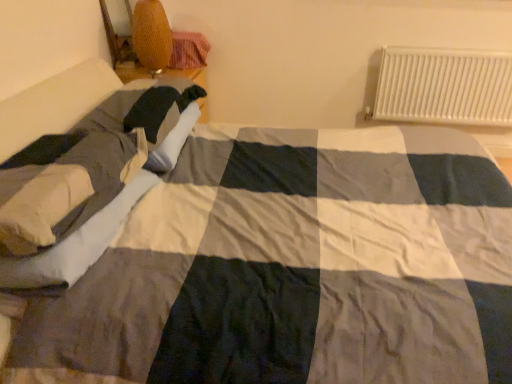
Question: From the image's perspective, does soft beige pillow at left appear higher than woven wicker lampshade at upper left?

Choices:
 (A) yes
 (B) no

Answer: (B)

Question: Is soft beige pillow at left oriented away from woven wicker lampshade at upper left?

Choices:
 (A) yes
 (B) no

Answer: (B)

Question: Does soft beige pillow at left have a smaller size compared to woven wicker lampshade at upper left?

Choices:
 (A) yes
 (B) no

Answer: (B)

Question: Considering the relative sizes of soft beige pillow at left and woven wicker lampshade at upper left in the image provided, is soft beige pillow at left thinner than woven wicker lampshade at upper left?

Choices:
 (A) no
 (B) yes

Answer: (A)

Question: Can you confirm if soft beige pillow at left is positioned to the left of woven wicker lampshade at upper left?

Choices:
 (A) no
 (B) yes

Answer: (B)

Question: Considering their positions, is soft beige pillow at left located in front of or behind woven wicker lampshade at upper left?

Choices:
 (A) behind
 (B) front

Answer: (B)

Question: From a real-world perspective, is soft beige pillow at left above or below woven wicker lampshade at upper left?

Choices:
 (A) above
 (B) below

Answer: (B)

Question: In terms of height, does soft beige pillow at left look taller or shorter compared to woven wicker lampshade at upper left?

Choices:
 (A) short
 (B) tall

Answer: (A)

Question: Is soft beige pillow at left wider or thinner than woven wicker lampshade at upper left?

Choices:
 (A) wide
 (B) thin

Answer: (A)

Question: Considering the positions of soft beige pillow at left and white metal radiator at upper right in the image, is soft beige pillow at left bigger or smaller than white metal radiator at upper right?

Choices:
 (A) big
 (B) small

Answer: (A)

Question: Is soft beige pillow at left wider or thinner than white metal radiator at upper right?

Choices:
 (A) wide
 (B) thin

Answer: (A)

Question: From the image's perspective, is soft beige pillow at left positioned above or below white metal radiator at upper right?

Choices:
 (A) below
 (B) above

Answer: (A)

Question: Is soft beige pillow at left in front of or behind white metal radiator at upper right in the image?

Choices:
 (A) behind
 (B) front

Answer: (B)

Question: From a real-world perspective, is woven wicker lampshade at upper left positioned above or below white metal radiator at upper right?

Choices:
 (A) above
 (B) below

Answer: (A)

Question: Considering the positions of woven wicker lampshade at upper left and white metal radiator at upper right in the image, is woven wicker lampshade at upper left taller or shorter than white metal radiator at upper right?

Choices:
 (A) tall
 (B) short

Answer: (B)